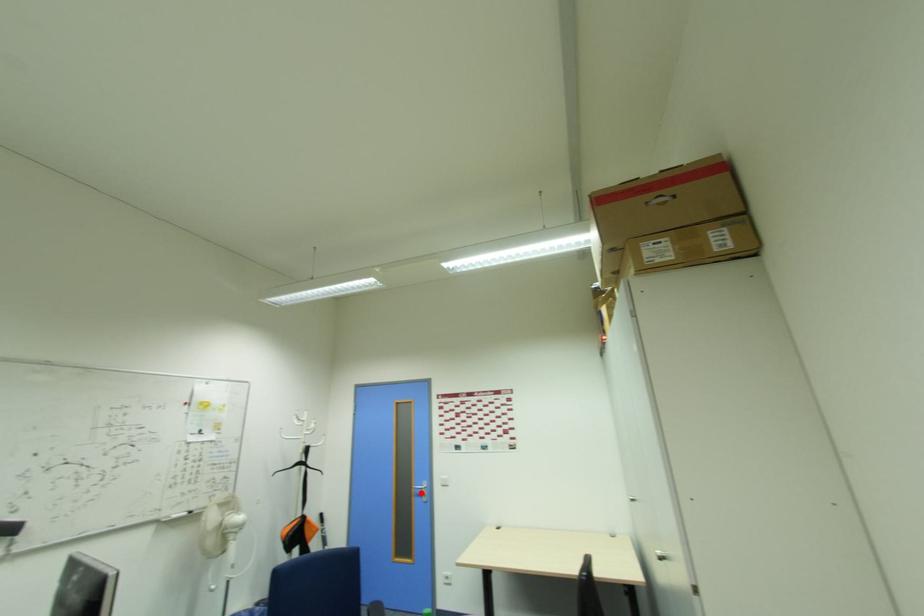
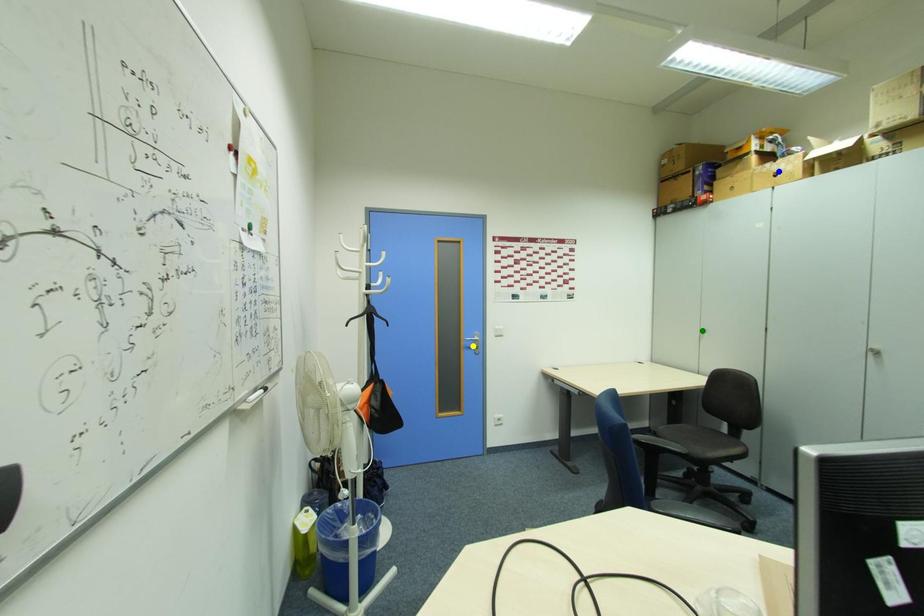
Question: I am providing you with two images of the same scene from different viewpoints. A red point is marked on the first image. You are given multiple points on the second image. Which point in image 2 represents the same 3d spot as the red point in image 1?

Choices:
 (A) blue point
 (B) green point
 (C) yellow point

Answer: (C)